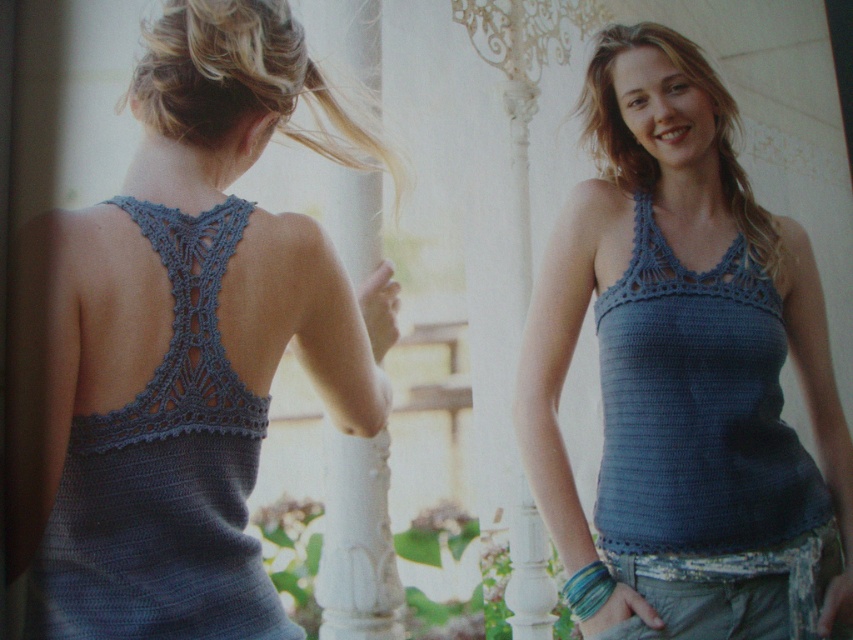
Question: Can you confirm if blondehair at right is smaller than blonde hair at upper center?

Choices:
 (A) yes
 (B) no

Answer: (B)

Question: Estimate the real-world distances between objects in this image. Which object is farther from the blondehair at right?

Choices:
 (A) blue knitted tank top at center
 (B) blonde hair at upper center
 (C) knitted blue tank top at back

Answer: (C)

Question: Can you confirm if denim crochet halter top at center is bigger than blondehair at back?

Choices:
 (A) yes
 (B) no

Answer: (B)

Question: Is crochet blue halter top at back to the left of blondehair at right from the viewer's perspective?

Choices:
 (A) yes
 (B) no

Answer: (A)

Question: Which point is closer to the camera?

Choices:
 (A) blondehair at back
 (B) knitted blue tank top at back
 (C) blue knitted tank top at center

Answer: (B)

Question: Which point appears closest to the camera in this image?

Choices:
 (A) (167, 118)
 (B) (682, 362)
 (C) (283, 225)
 (D) (152, 225)

Answer: (D)